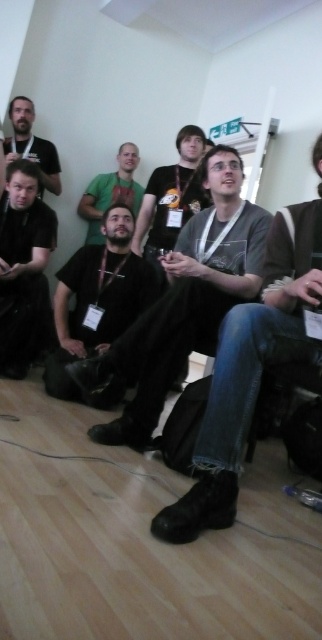
You are standing in the middle of the room and see a point marked at coordinates (97, 298). According to the scene description, what object or person is located at that specific point?

The point at coordinates (97, 298) indicates the location of the matte black shirt at center.

You are organizing a photo shoot and need to know which of the two items takes up more visual space in the image for lighting adjustments. Which one is larger in size between the matte black shirt at left and the dark brown leather jacket at center?

The dark brown leather jacket at center is larger in size than the matte black shirt at left, so it occupies more visual space and would require more lighting adjustments.